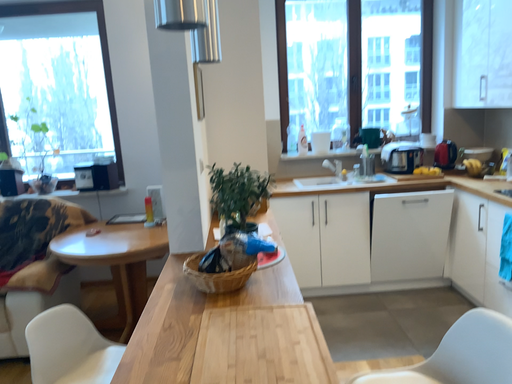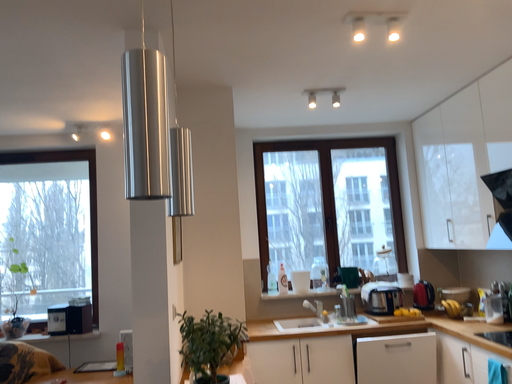
Question: How did the camera likely rotate when shooting the video?

Choices:
 (A) rotated downward
 (B) rotated upward

Answer: (B)